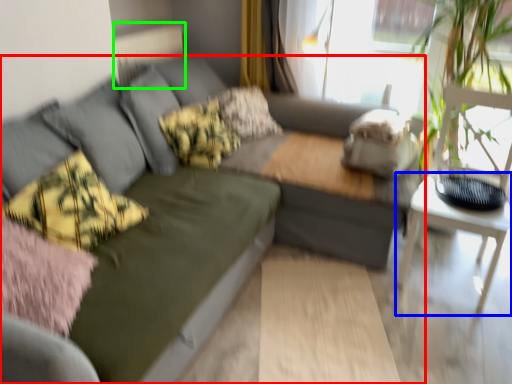
Question: Estimate the real-world distances between objects in this image. Which object is closer to studio couch (highlighted by a red box), table (highlighted by a blue box) or radiator (highlighted by a green box)?

Choices:
 (A) table
 (B) radiator

Answer: (A)